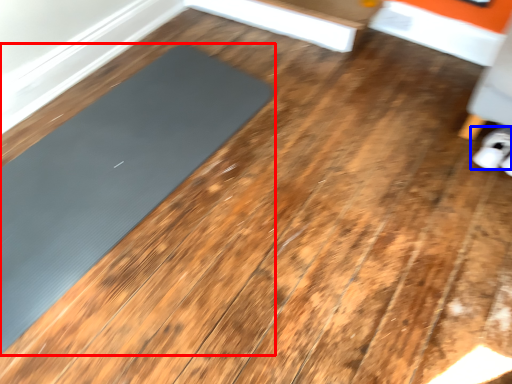
Question: Which of the following is the closest to the observer, mat (highlighted by a red box) or footwear (highlighted by a blue box)?

Choices:
 (A) mat
 (B) footwear

Answer: (A)